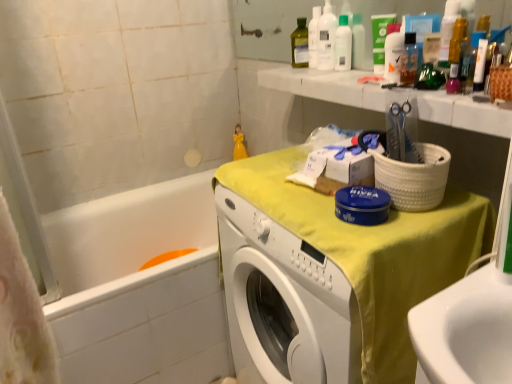
This screenshot has height=384, width=512. What are the coordinates of `empty space that is ontop of yellow fabric-covered washer at center` in the screenshot? It's located at (304, 190).